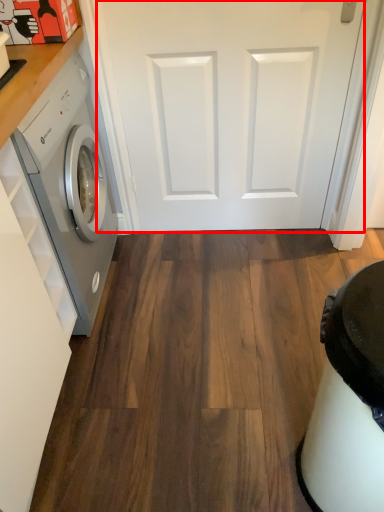
Question: From the image's perspective, where is door (annotated by the red box) located relative to washing machine?

Choices:
 (A) below
 (B) above

Answer: (B)